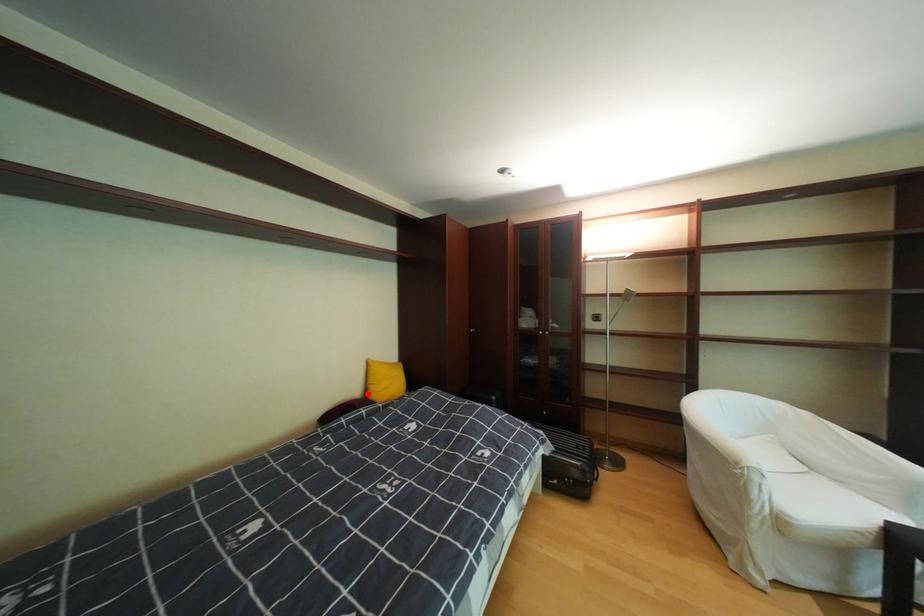
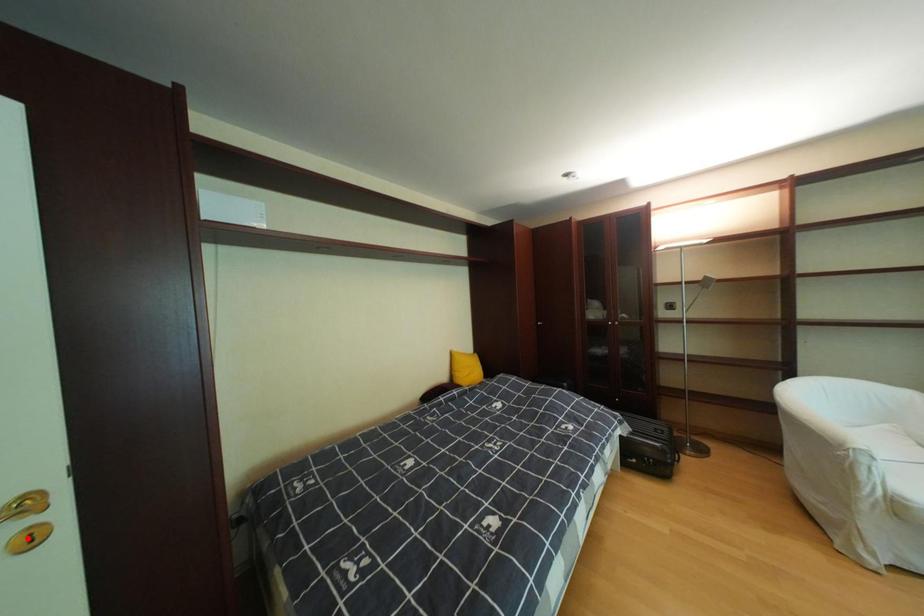
I am providing you with two images of the same scene from different viewpoints. A red point is marked on the first image and another point is marked on the second image. Are the points marked in image1 and image2 representing the same 3D position?

No